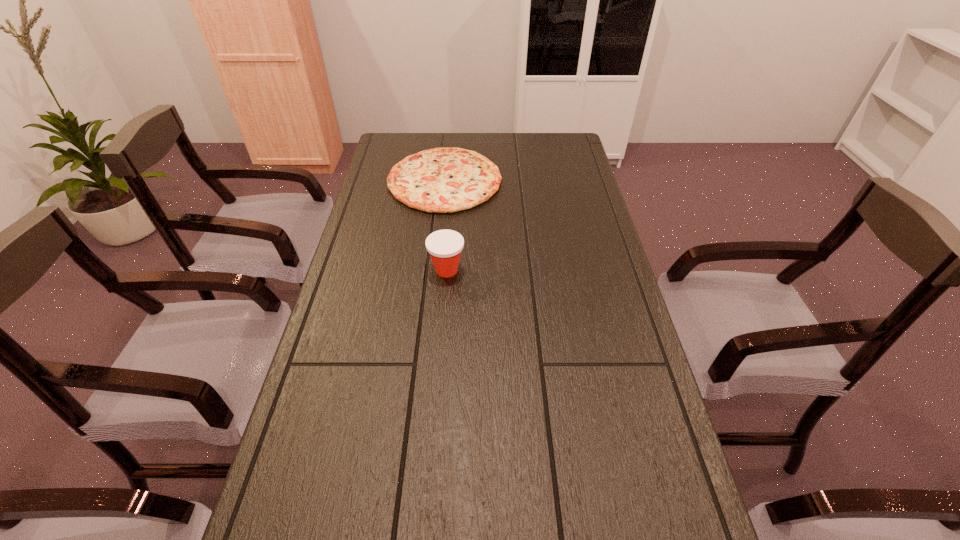
In the image, there is a desktop. Identify the location of blank space at the right edge. The height and width of the screenshot is (540, 960). (548, 205).

Where is `vacant space at the far right corner of the desktop`? vacant space at the far right corner of the desktop is located at coordinates (562, 139).

This screenshot has width=960, height=540. In order to click on vacant space that satisfies the following two spatial constraints: 1. on the front side of the taller object; 2. on the left side of the shorter object in this screenshot , I will do `click(436, 270)`.